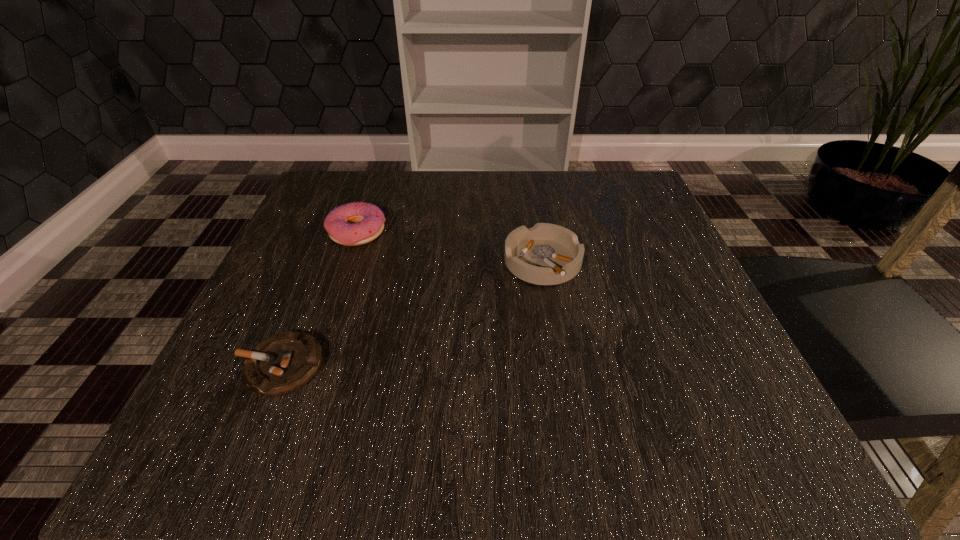
Find the location of a particular element. The image size is (960, 540). free space between the doughnut and the shorter ashtray is located at coordinates (320, 299).

Image resolution: width=960 pixels, height=540 pixels. I want to click on unoccupied position between the shortest object and the doughnut, so click(x=320, y=299).

Where is `free point between the left ashtray and the doughnut`? Image resolution: width=960 pixels, height=540 pixels. free point between the left ashtray and the doughnut is located at coordinates (320, 299).

You are a GUI agent. You are given a task and a screenshot of the screen. Output one action in this format:
    pyautogui.click(x=<x>, y=<y>)
    Task: Click on the empty space that is in between the right ashtray and the doughnut
    
    Given the screenshot: What is the action you would take?
    pyautogui.click(x=450, y=248)

In order to click on free space between the doughnut and the farther ashtray in this screenshot , I will do `click(450, 248)`.

This screenshot has width=960, height=540. Find the location of `vacant area that lies between the doughnut and the taller ashtray`. vacant area that lies between the doughnut and the taller ashtray is located at coordinates (450, 248).

Find the location of `free space between the rightmost object and the doughnut`. free space between the rightmost object and the doughnut is located at coordinates (450, 248).

Find the location of a particular element. free spot between the farther ashtray and the doughnut is located at coordinates (450, 248).

Locate which object ranks in proximity to the taller ashtray. Please provide its 2D coordinates. Your answer should be formatted as a tuple, i.e. [(x, y)], where the tuple contains the x and y coordinates of a point satisfying the conditions above.

[(352, 224)]

What are the coordinates of `object that stands as the closest to the doughnut` in the screenshot? It's located at (282, 363).